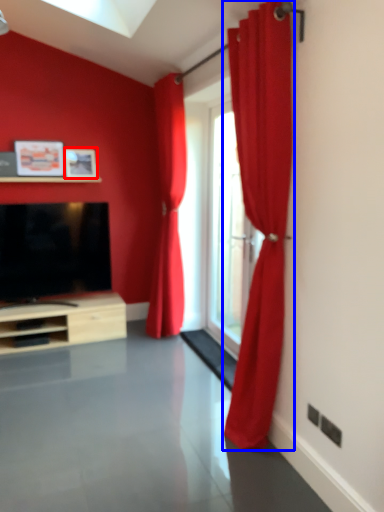
Question: Which object appears closest to the camera in this image, picture frame (highlighted by a red box) or curtain (highlighted by a blue box)?

Choices:
 (A) picture frame
 (B) curtain

Answer: (B)